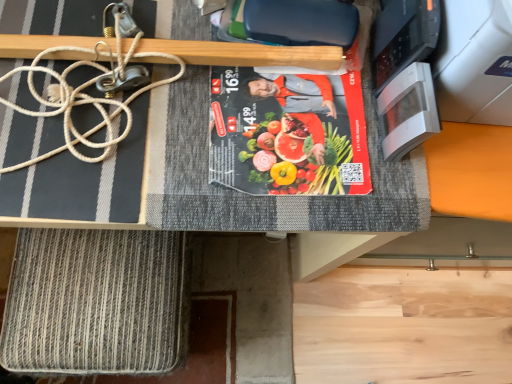
The width and height of the screenshot is (512, 384). I want to click on vacant area on top of rope-like textured mat at lower left (from a real-world perspective), so click(x=93, y=294).